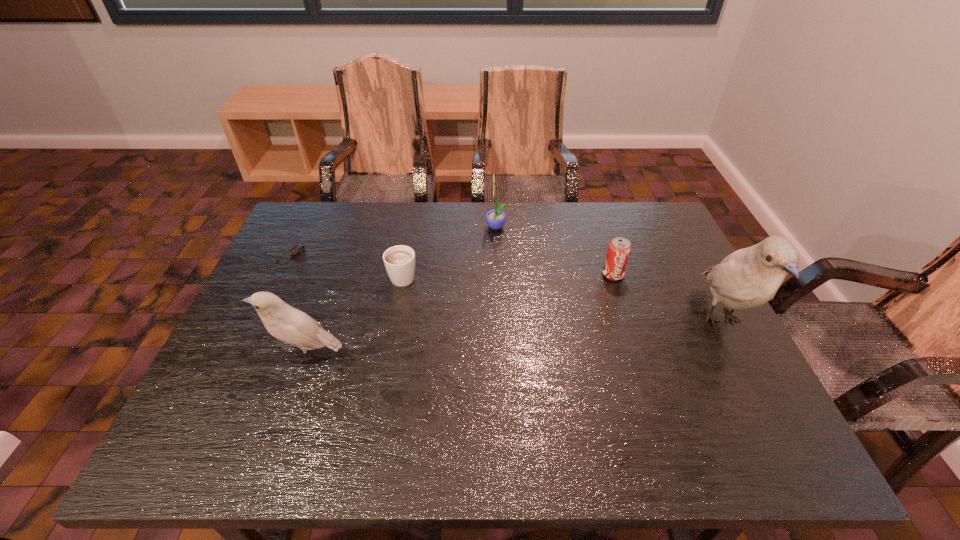
Locate an element on the screen. free space located with the handle on the side of the cappuccino is located at coordinates (413, 222).

Identify the location of vacant space situated 0.090m with the handle on the side of the cappuccino. The width and height of the screenshot is (960, 540). click(x=409, y=243).

This screenshot has width=960, height=540. Find the location of `vacant space situated with the handle on the side of the cappuccino`. vacant space situated with the handle on the side of the cappuccino is located at coordinates (416, 210).

Locate an element on the screen. The height and width of the screenshot is (540, 960). mouse situated at the far edge is located at coordinates (298, 248).

Image resolution: width=960 pixels, height=540 pixels. Identify the location of sunflower that is at the far edge. (495, 219).

This screenshot has width=960, height=540. I want to click on bird that is positioned at the left edge, so click(284, 322).

You are a GUI agent. You are given a task and a screenshot of the screen. Output one action in this format:
    pyautogui.click(x=<x>, y=<y>)
    Task: Click on the mouse that is at the left edge
    
    Given the screenshot: What is the action you would take?
    pyautogui.click(x=298, y=248)

I want to click on object that is at the right edge, so click(x=750, y=277).

The width and height of the screenshot is (960, 540). Identify the location of object situated at the far left corner. pos(298,248).

In order to click on free location at the far edge of the desktop in this screenshot , I will do `click(610, 213)`.